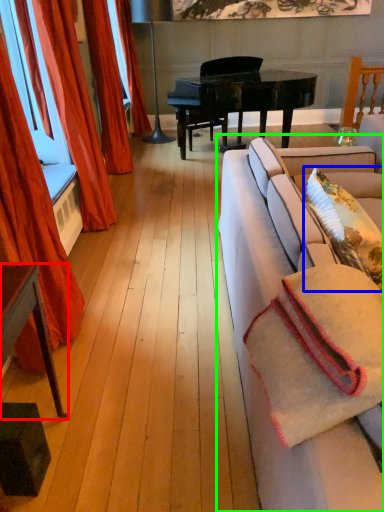
Question: Estimate the real-world distances between objects in this image. Which object is closer to table (highlighted by a red box), pillow (highlighted by a blue box) or studio couch (highlighted by a green box)?

Choices:
 (A) pillow
 (B) studio couch

Answer: (B)